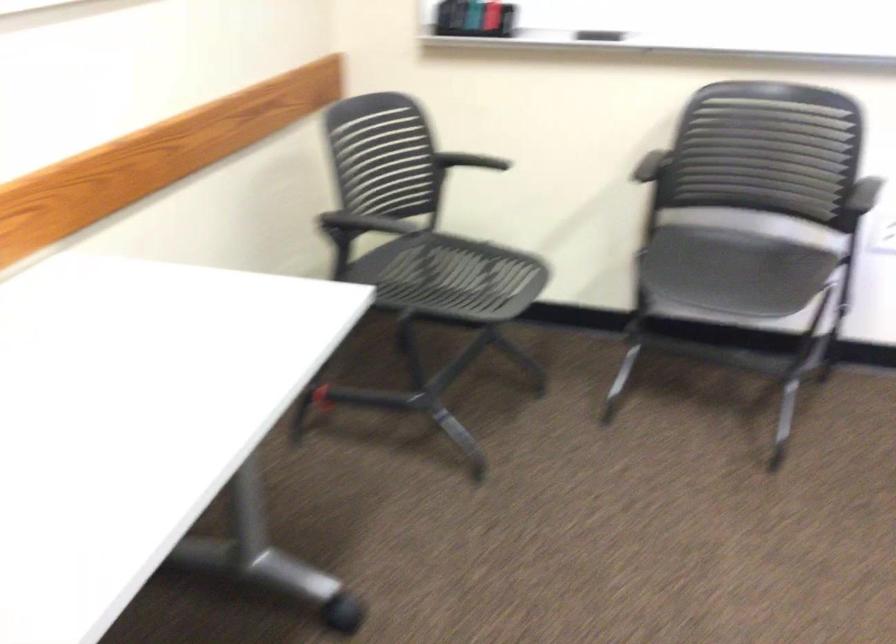
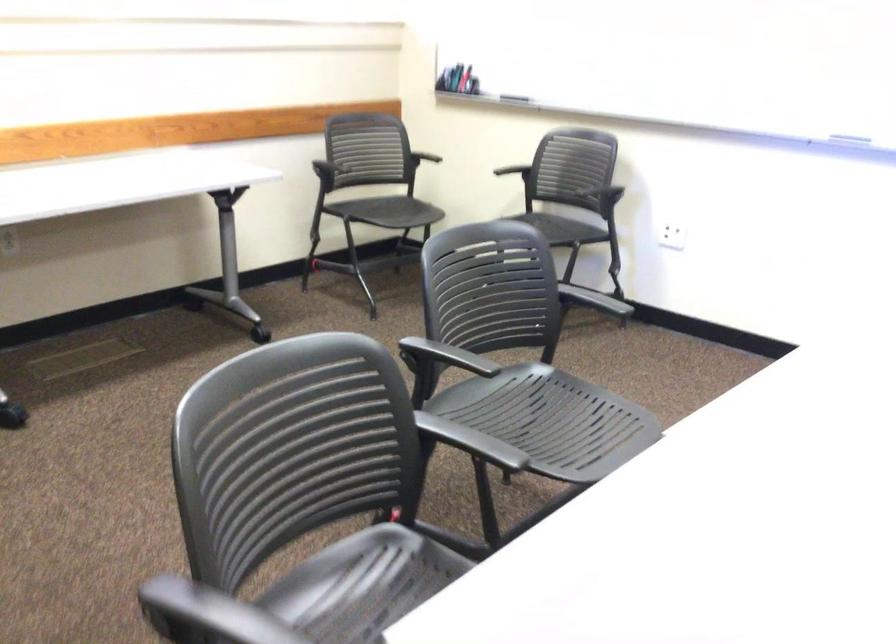
The point at (364, 223) is marked in the first image. Where is the corresponding point in the second image?

(330, 158)